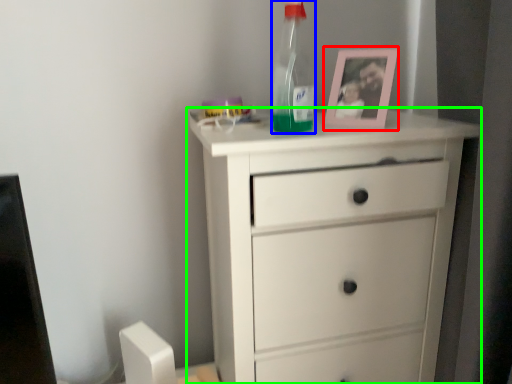
Question: Which object is the closest to the picture frame (highlighted by a red box)? Choose among these: bottle (highlighted by a blue box) or chest of drawers (highlighted by a green box).

Choices:
 (A) bottle
 (B) chest of drawers

Answer: (A)